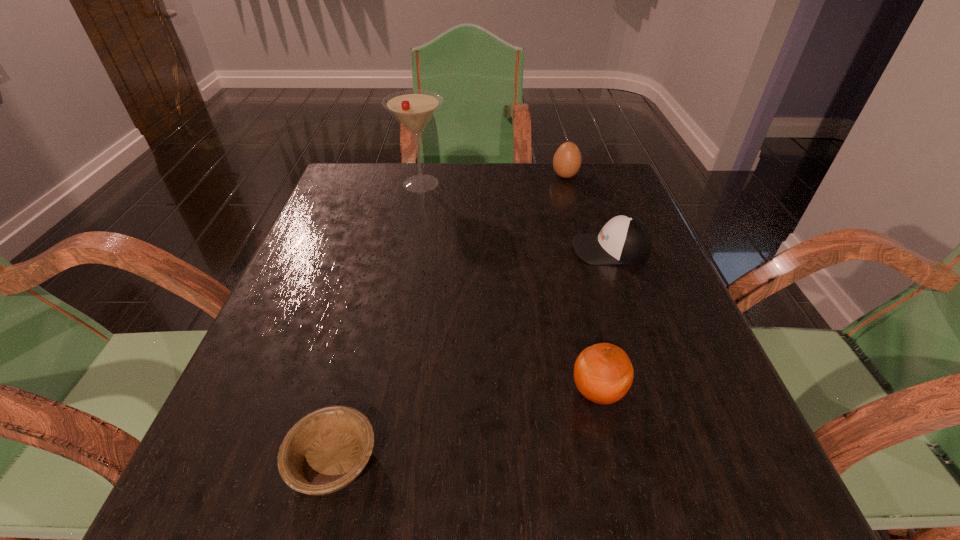
Image resolution: width=960 pixels, height=540 pixels. Identify the location of the fourth closest object to the bowl. (567, 160).

In order to click on vacant space that satisfies the following two spatial constraints: 1. on the front panel of the third nearest object; 2. on the front side of the bowl in this screenshot , I will do `click(685, 461)`.

This screenshot has width=960, height=540. What are the coordinates of `vacant space that satisfies the following two spatial constraints: 1. on the front side of the martini; 2. on the left side of the orange` in the screenshot? It's located at (380, 392).

Locate an element on the screen. The image size is (960, 540). vacant space that satisfies the following two spatial constraints: 1. on the back side of the shortest object; 2. on the right side of the orange is located at coordinates (350, 392).